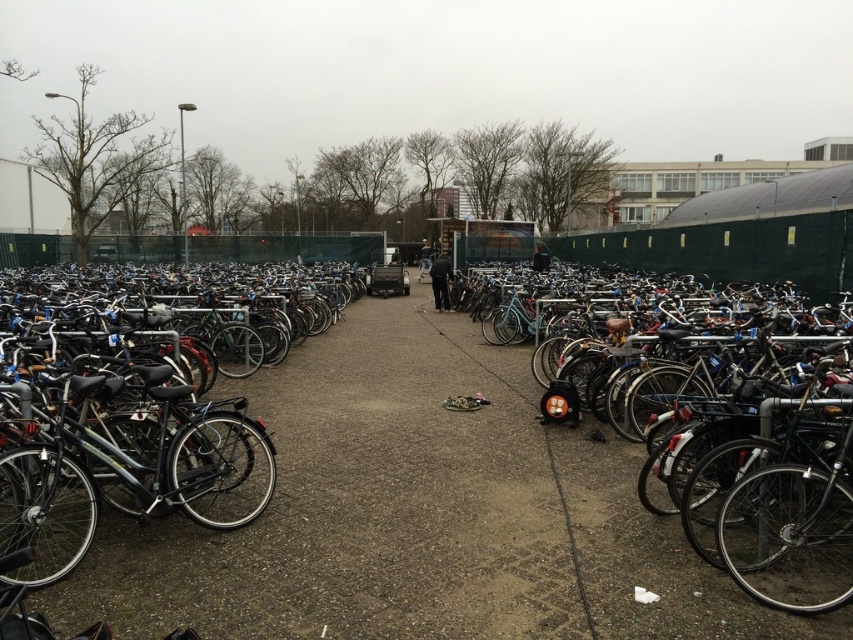
You are standing at the center of the bicycle parking area and see a point marked at coordinates (x=758, y=497). Which object is this point located on?

The point at coordinates (x=758, y=497) is located on the shiny metallic bicycle at right.

You are standing at the entrance of the bicycle parking area and want to locate the shiny black bicycle at left. According to the coordinates provided, in which direction should you walk to find it?

The shiny black bicycle at left is located at point (126, 465). Since the x coordinate is higher than 0.5, you should walk towards the right side of the parking area to find it.